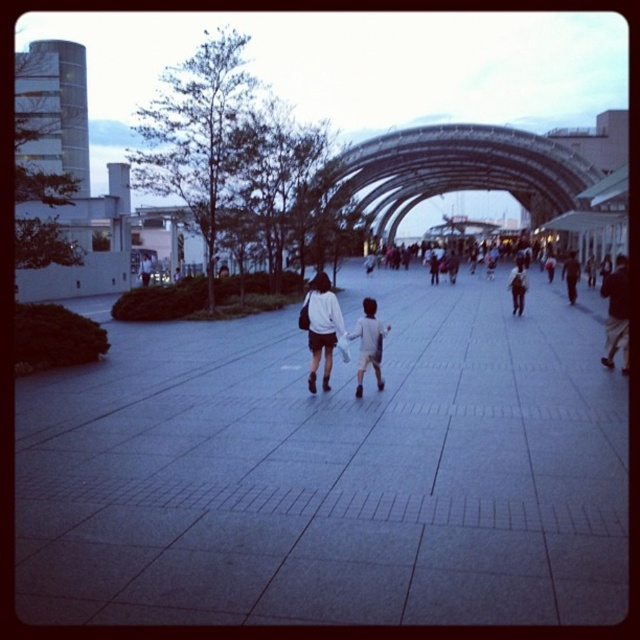
Consider the image. Can you confirm if dark gray pants at center is positioned below dark blue jeans at center?

Indeed, dark gray pants at center is positioned under dark blue jeans at center.

Describe the element at coordinates (516, 285) in the screenshot. This screenshot has height=640, width=640. I see `dark gray pants at center` at that location.

I want to click on dark gray pants at center, so click(516, 285).

Which is in front, point (380, 333) or point (513, 305)?

Point (380, 333)

This screenshot has height=640, width=640. What do you see at coordinates (369, 342) in the screenshot?
I see `white cotton shirt at center` at bounding box center [369, 342].

What do you see at coordinates (369, 342) in the screenshot? I see `white cotton shirt at center` at bounding box center [369, 342].

The image size is (640, 640). In order to click on white cotton shirt at center in this screenshot , I will do `click(369, 342)`.

Is dark fabric jacket at center to the left of white cotton shirt at center from the viewer's perspective?

In fact, dark fabric jacket at center is to the right of white cotton shirt at center.

Is dark fabric jacket at center shorter than white cotton shirt at center?

Answer: In fact, dark fabric jacket at center may be taller than white cotton shirt at center.

Find the location of `dark fabric jacket at center`. dark fabric jacket at center is located at coordinates (616, 312).